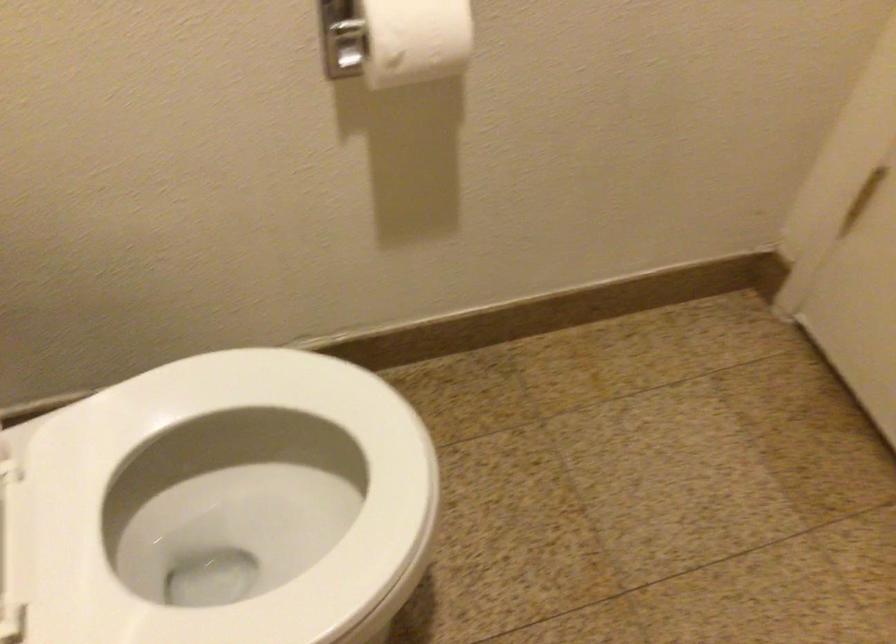
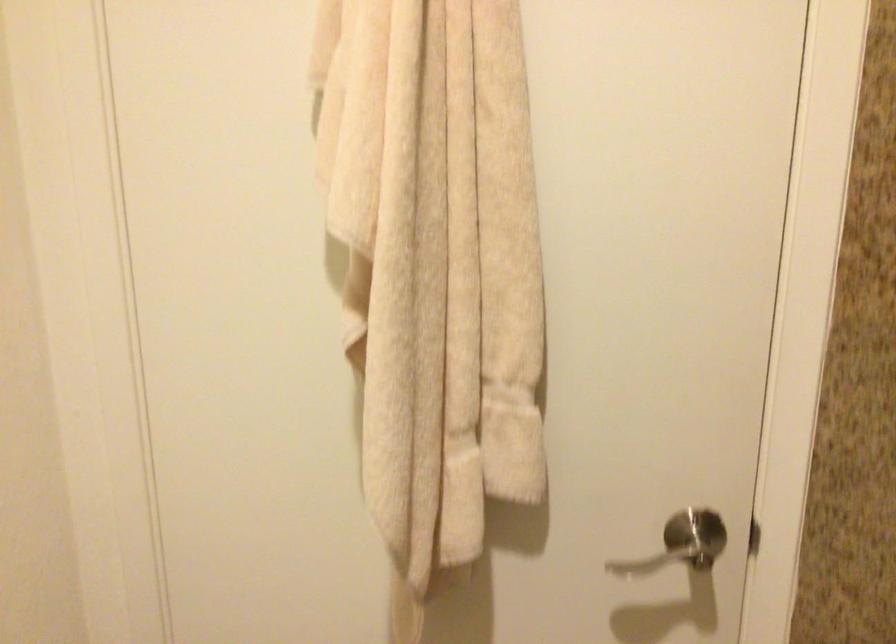
Question: The images are taken continuously from a first-person perspective. In which direction is your viewpoint rotating?

Choices:
 (A) Left
 (B) Right
 (C) Up
 (D) Down

Answer: (B)